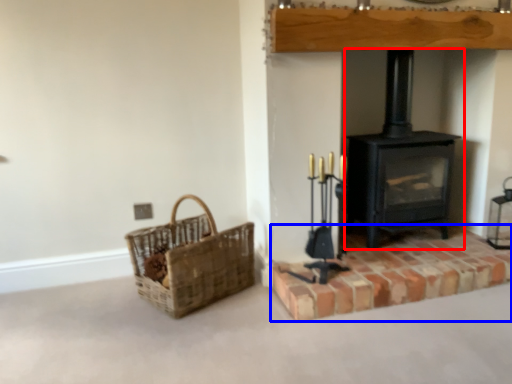
Question: Which of the following is the farthest to the observer, wood burning stove (highlighted by a red box) or brickwork (highlighted by a blue box)?

Choices:
 (A) wood burning stove
 (B) brickwork

Answer: (A)